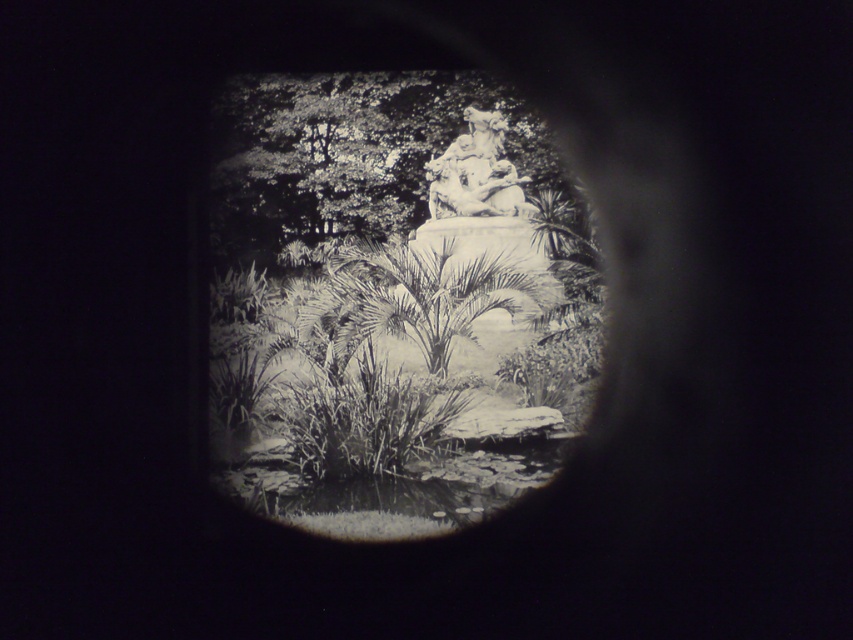
Between smooth stone statue at center and white marble statue at center, which one has less height?

smooth stone statue at center

What are the coordinates of `smooth stone statue at center` in the screenshot? It's located at (360, 152).